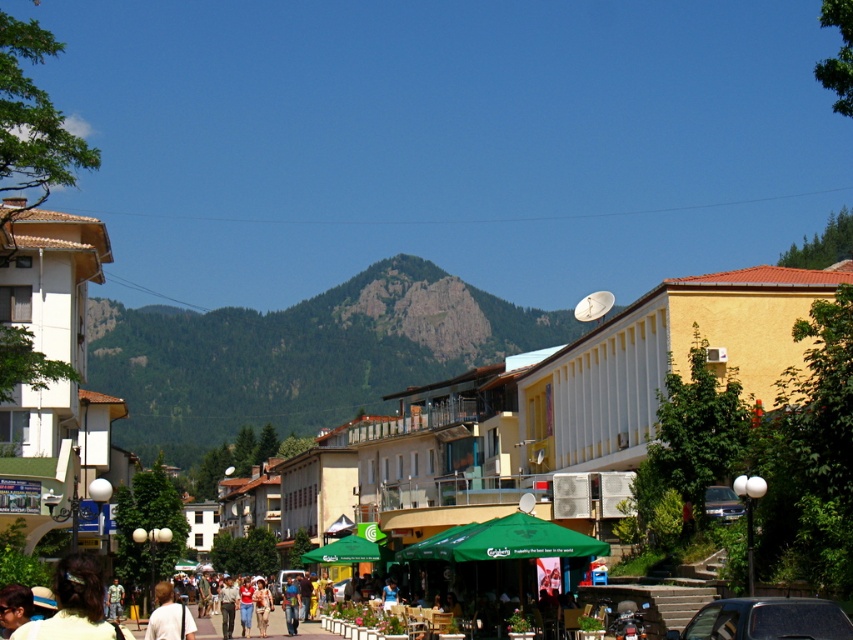
Who is positioned more to the left, green rocky mountain at center or black glossy car at center?

green rocky mountain at center

Who is more distant from viewer, (x=184, y=442) or (x=840, y=632)?

Positioned behind is point (x=184, y=442).

Find the location of a particular element. This screenshot has height=640, width=853. green rocky mountain at center is located at coordinates (300, 355).

Who is taller, light brown hair at center or metallic silver car at lower right?

Standing taller between the two is light brown hair at center.

Who is more forward, (184, 618) or (705, 509)?

Point (184, 618) is in front.

Who is more distant from viewer, (170,611) or (738,508)?

The point (738,508) is behind.

You are a GUI agent. You are given a task and a screenshot of the screen. Output one action in this format:
    pyautogui.click(x=<x>, y=<y>)
    Task: Click on the light brown hair at center
    This screenshot has height=640, width=853.
    Given the screenshot: What is the action you would take?
    pyautogui.click(x=167, y=616)

Looking at this image, who is positioned more to the left, black glossy car at center or light brown hair at center?

light brown hair at center

Based on the photo, can you confirm if black glossy car at center is bigger than light brown hair at center?

Actually, black glossy car at center might be smaller than light brown hair at center.

Where is `black glossy car at center`? black glossy car at center is located at coordinates [767, 620].

Where is `black glossy car at center`? black glossy car at center is located at coordinates (767, 620).